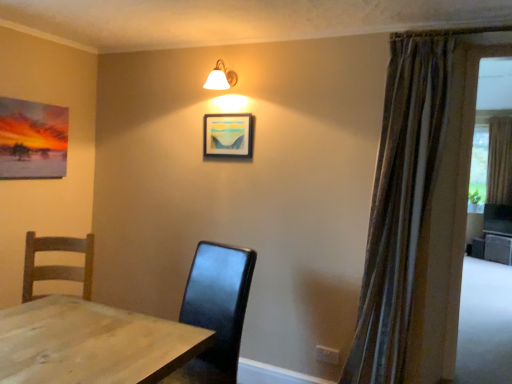
Question: Considering the relative positions of striped fabric curtain at right, marked as the first curtain in a left-to-right arrangement, and white glass lamp at upper center in the image provided, is striped fabric curtain at right, marked as the first curtain in a left-to-right arrangement, to the left or to the right of white glass lamp at upper center?

Choices:
 (A) left
 (B) right

Answer: (B)

Question: From a real-world perspective, relative to white glass lamp at upper center, is striped fabric curtain at right, the second curtain in the right-to-left sequence, vertically above or below?

Choices:
 (A) below
 (B) above

Answer: (A)

Question: Which of these objects is positioned closest to the matte wooden picture frame at upper center?

Choices:
 (A) white glass lamp at upper center
 (B) striped fabric curtain at right, the second curtain in the right-to-left sequence
 (C) brown textured curtain at right, acting as the 2th curtain starting from the front

Answer: (A)

Question: Which is farther from the brown textured curtain at right, positioned as the first curtain in right-to-left order?

Choices:
 (A) matte wooden picture frame at upper center
 (B) white glass lamp at upper center
 (C) striped fabric curtain at right, marked as the first curtain in a left-to-right arrangement

Answer: (B)